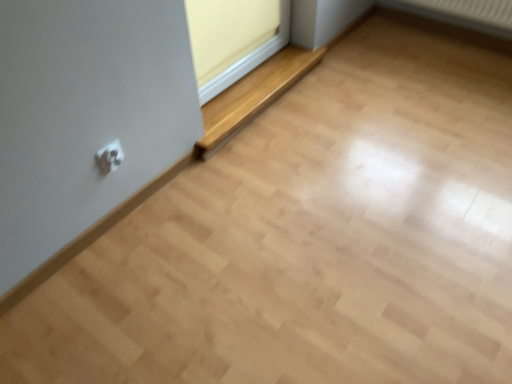
Question: Considering the positions of wooden at lower center and matte yellow window frame at upper center in the image, is wooden at lower center wider or thinner than matte yellow window frame at upper center?

Choices:
 (A) wide
 (B) thin

Answer: (A)

Question: From a real-world perspective, is wooden at lower center physically located above or below matte yellow window frame at upper center?

Choices:
 (A) above
 (B) below

Answer: (B)

Question: Estimate the real-world distances between objects in this image. Which object is farther from the white plastic electric outlet at lower left?

Choices:
 (A) wooden at lower center
 (B) matte yellow window frame at upper center

Answer: (B)

Question: Which object is positioned closest to the white plastic electric outlet at lower left?

Choices:
 (A) wooden at lower center
 (B) matte yellow window frame at upper center

Answer: (A)